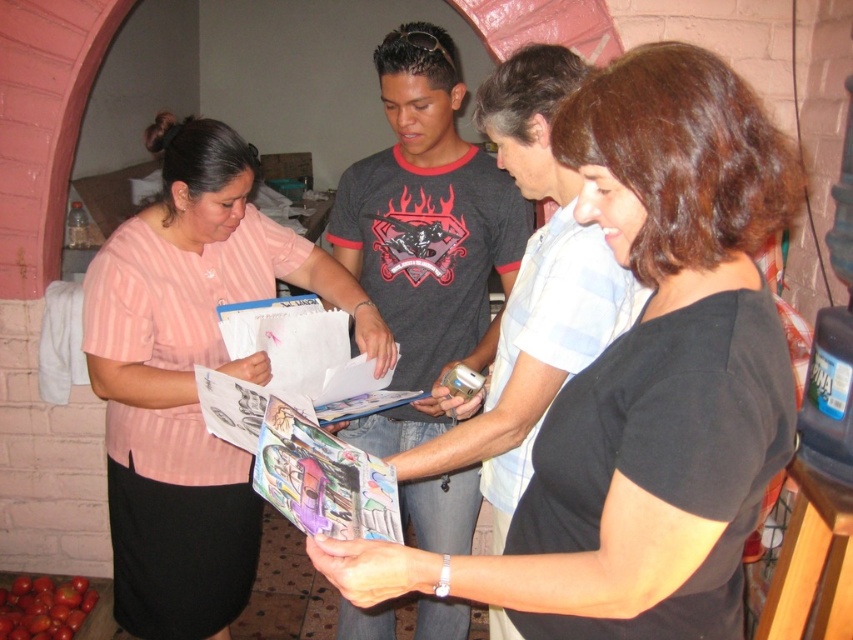
Where is `pink striped shirt at left`? pink striped shirt at left is located at coordinates (190, 376).

Find the location of a particular element. The width and height of the screenshot is (853, 640). pink striped shirt at left is located at coordinates (190, 376).

Is black matte shirt at center bigger than dark gray t-shirt at center?

Incorrect, black matte shirt at center is not larger than dark gray t-shirt at center.

Is point (743, 454) positioned before point (416, 58)?

Yes, point (743, 454) is closer to viewer.

This screenshot has height=640, width=853. Find the location of `black matte shirt at center`. black matte shirt at center is located at coordinates (643, 378).

Does black matte shirt at center have a lesser height compared to pink striped shirt at left?

Yes, black matte shirt at center is shorter than pink striped shirt at left.

Does black matte shirt at center have a lesser width compared to pink striped shirt at left?

Correct, black matte shirt at center's width is less than pink striped shirt at left's.

You are a GUI agent. You are given a task and a screenshot of the screen. Output one action in this format:
    pyautogui.click(x=<x>, y=<y>)
    Task: Click on the black matte shirt at center
    
    Given the screenshot: What is the action you would take?
    pyautogui.click(x=643, y=378)